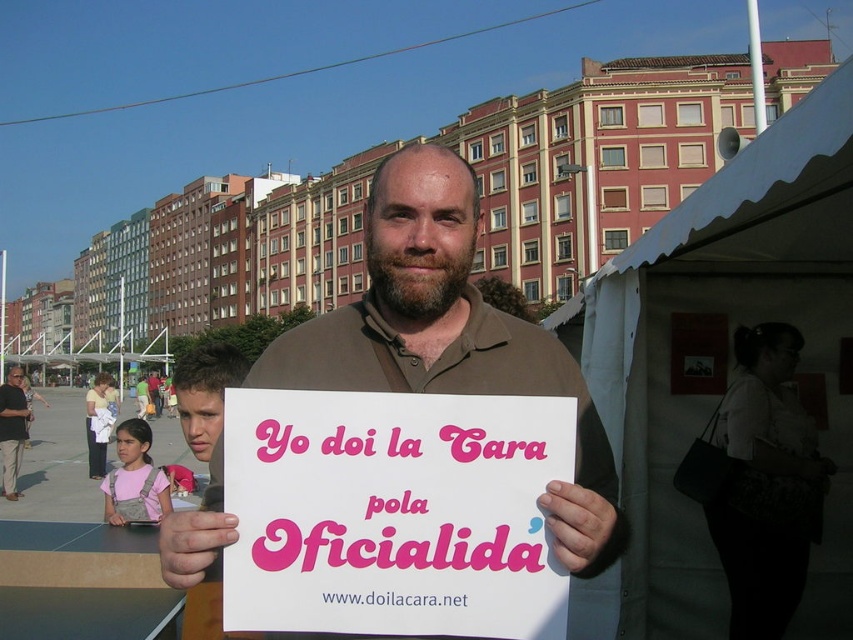
Question: Is pink paper sign at center smaller than brown cotton shirt at center?

Choices:
 (A) no
 (B) yes

Answer: (B)

Question: Among these objects, which one is nearest to the camera?

Choices:
 (A) matte black shirt at lower left
 (B) brown cotton shirt at center

Answer: (B)

Question: Among these objects, which one is farthest from the camera?

Choices:
 (A) matte black shirt at lower left
 (B) brown cotton shirt at center

Answer: (A)

Question: Observing the image, what is the correct spatial positioning of brown cotton shirt at center in reference to matte black shirt at lower left?

Choices:
 (A) below
 (B) above

Answer: (B)

Question: Which point appears closest to the camera in this image?

Choices:
 (A) (277, 602)
 (B) (471, 298)
 (C) (16, 422)

Answer: (A)

Question: From the image, what is the correct spatial relationship of brown cotton shirt at center in relation to matte black shirt at lower left?

Choices:
 (A) above
 (B) below

Answer: (A)